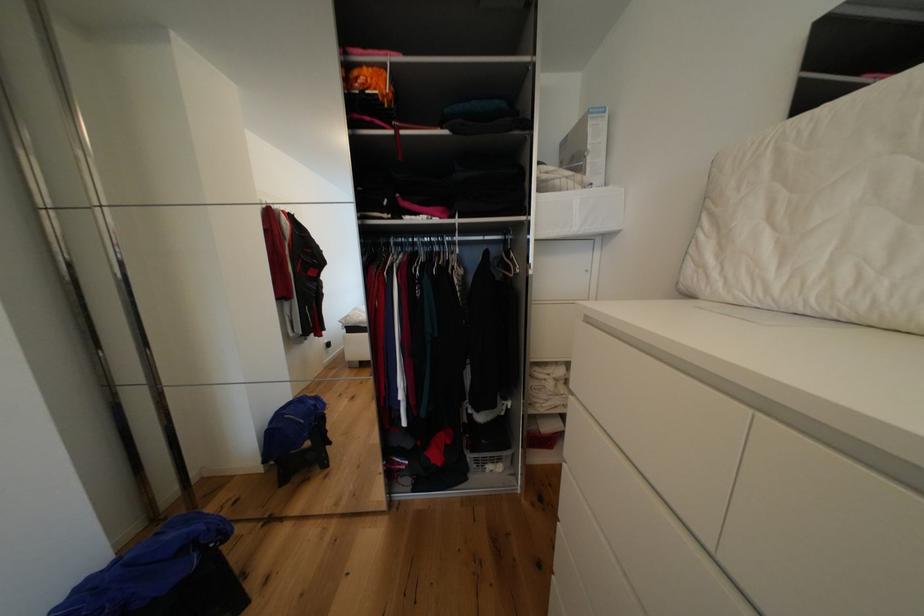
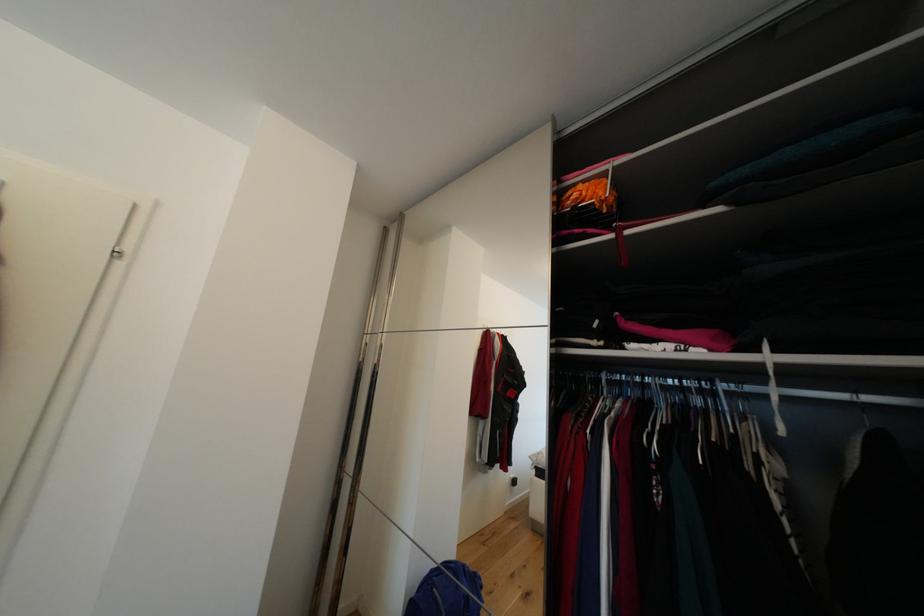
Locate, in the second image, the point that corresponds to pixel 372 71 in the first image.

(588, 188)